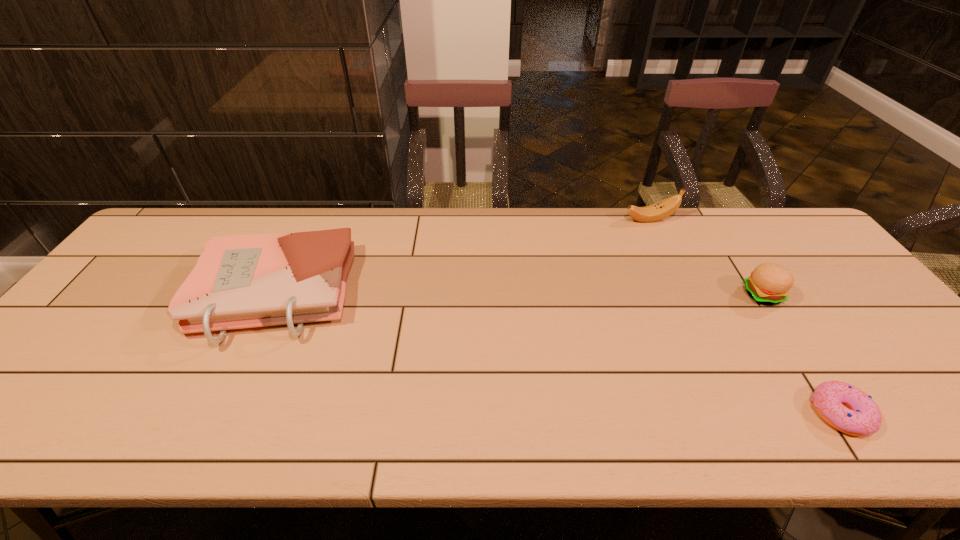
The height and width of the screenshot is (540, 960). Identify the location of free space between the farthest object and the phonebook. (462, 256).

The height and width of the screenshot is (540, 960). In order to click on unoccupied position between the hamburger and the leftmost object in this screenshot , I will do `click(518, 294)`.

Find the location of `empty space between the phonebook and the doughnut`. empty space between the phonebook and the doughnut is located at coordinates (557, 354).

This screenshot has width=960, height=540. I want to click on vacant space in between the nearest object and the banana, so click(745, 316).

This screenshot has height=540, width=960. Find the location of `unoccupied area between the banana and the shortest object`. unoccupied area between the banana and the shortest object is located at coordinates (745, 316).

Locate an element on the screen. This screenshot has width=960, height=540. vacant space that is in between the farthest object and the doughnut is located at coordinates (745, 316).

The height and width of the screenshot is (540, 960). In order to click on vacant area that lies between the hamburger and the nearest object in this screenshot , I will do `click(802, 354)`.

Locate which object ranks second in proximity to the nearest object. Please provide its 2D coordinates. Your answer should be formatted as a tuple, i.e. [(x, y)], where the tuple contains the x and y coordinates of a point satisfying the conditions above.

[(664, 208)]

The image size is (960, 540). I want to click on object that stands as the third closest to the doughnut, so click(240, 281).